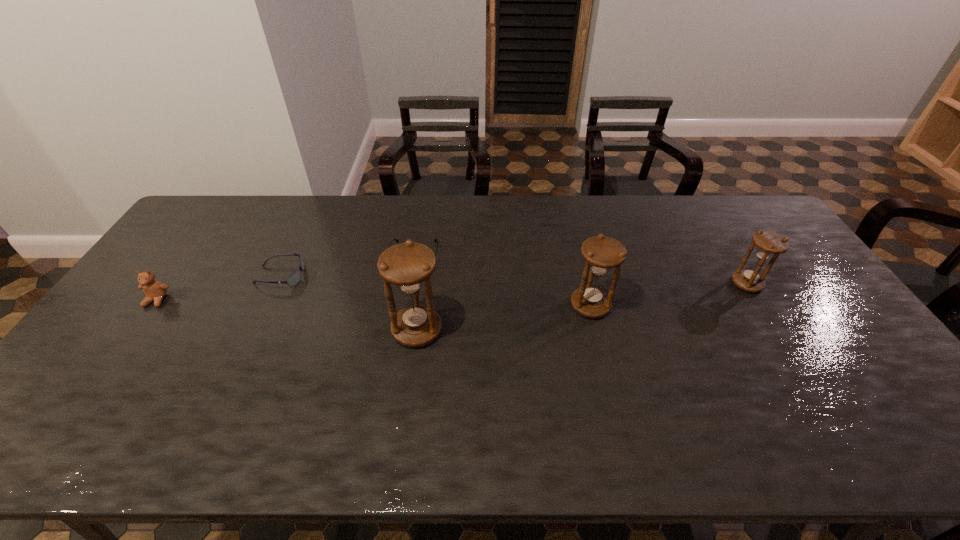
Locate an element on the screen. the second object from left to right is located at coordinates 295,277.

Locate an element on the screen. This screenshot has height=540, width=960. free location located on the left of the leftmost hourglass is located at coordinates (304, 330).

Image resolution: width=960 pixels, height=540 pixels. What are the coordinates of `free space located on the right of the second hourglass from left to right` in the screenshot? It's located at (741, 306).

Where is `vacant space positioned on the back of the fourth shortest object`? The width and height of the screenshot is (960, 540). vacant space positioned on the back of the fourth shortest object is located at coordinates (732, 259).

This screenshot has width=960, height=540. What are the coordinates of `free space located 0.190m on the front-facing side of the spectacles` in the screenshot? It's located at (404, 318).

Locate an element on the screen. The height and width of the screenshot is (540, 960). free region located on the face of the leftmost object is located at coordinates (99, 381).

You are a GUI agent. You are given a task and a screenshot of the screen. Output one action in this format:
    pyautogui.click(x=<x>, y=<y>)
    Task: Click on the vacant area situated 0.170m on the lenses of the second object from left to right
    
    Given the screenshot: What is the action you would take?
    pyautogui.click(x=359, y=276)

Identify the location of object located at the left edge. This screenshot has width=960, height=540. (154, 290).

Locate an element on the screen. This screenshot has height=540, width=960. vacant space at the far edge is located at coordinates (250, 207).

Locate an element on the screen. This screenshot has height=540, width=960. vacant area at the near edge is located at coordinates (706, 405).